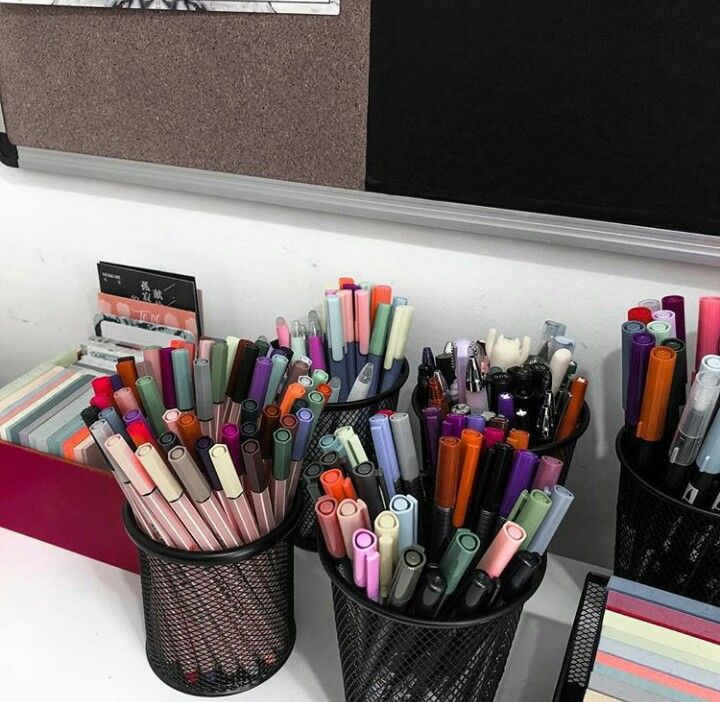
The image size is (720, 702). I want to click on black pen holders, so click(230, 616), click(423, 641), click(335, 411), click(564, 444), click(662, 517).